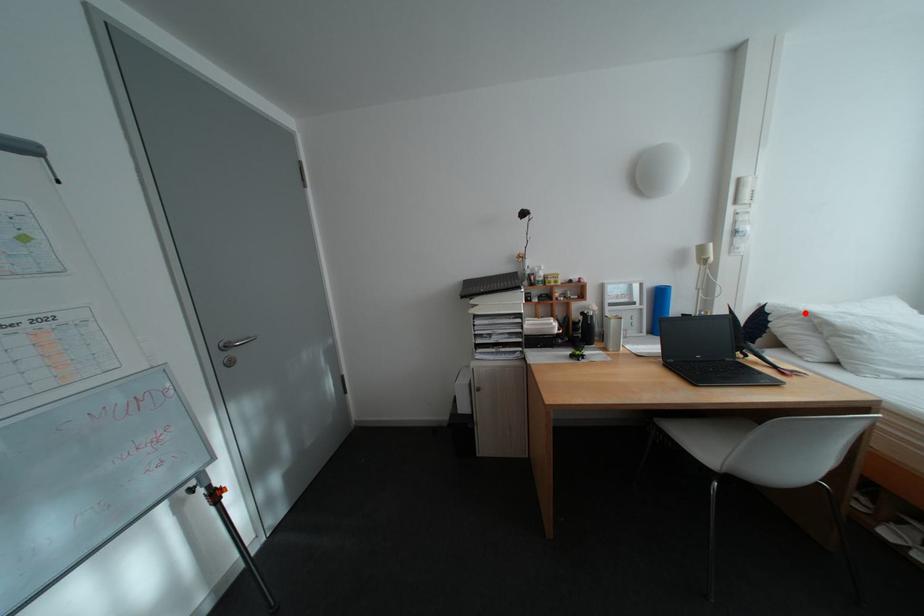
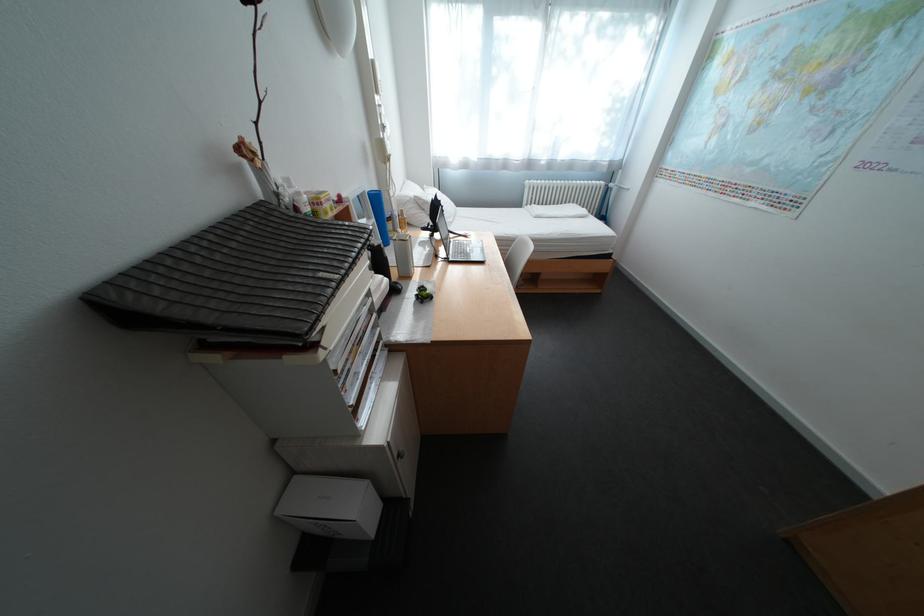
Locate, in the second image, the point that corresponds to the highlighted location in the first image.

(420, 200)